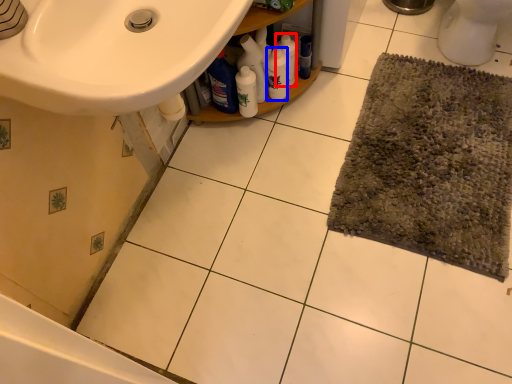
Question: Which object is closer to the camera taking this photo, cleaning product (highlighted by a red box) or cleaning product (highlighted by a blue box)?

Choices:
 (A) cleaning product
 (B) cleaning product

Answer: (B)